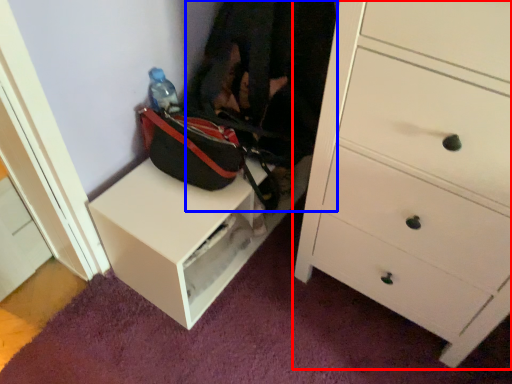
Question: Which object appears farthest to the camera in this image, chest of drawers (highlighted by a red box) or clothing (highlighted by a blue box)?

Choices:
 (A) chest of drawers
 (B) clothing

Answer: (B)